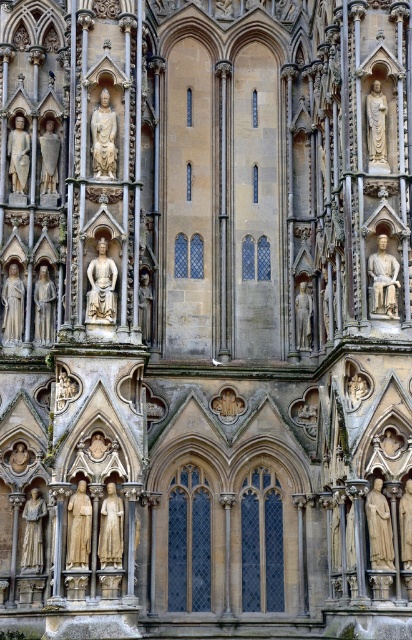
Who is taller, beige stone statue at center or stone statue at upper left?

beige stone statue at center

Is beige stone statue at center bigger than stone statue at upper left?

Yes, beige stone statue at center is bigger than stone statue at upper left.

Is point (384, 554) behind point (107, 124)?

No.

This screenshot has width=412, height=640. I want to click on beige stone statue at center, so click(x=379, y=528).

Is polished stone statue at right bigger than polished stone statue at center?

Yes.

Which is behind, point (374, 256) or point (308, 339)?

The point (308, 339) is more distant.

Where is `polished stone statue at right`? The height and width of the screenshot is (640, 412). polished stone statue at right is located at coordinates (383, 280).

From the picture: Is golden stone statue at center left wider than golden stone statue at lower left?

Correct, the width of golden stone statue at center left exceeds that of golden stone statue at lower left.

Does golden stone statue at center left appear over golden stone statue at lower left?

Indeed, golden stone statue at center left is positioned over golden stone statue at lower left.

This screenshot has height=640, width=412. What do you see at coordinates (102, 285) in the screenshot?
I see `golden stone statue at center left` at bounding box center [102, 285].

The width and height of the screenshot is (412, 640). What are the coordinates of `golden stone statue at center left` in the screenshot? It's located at (102, 285).